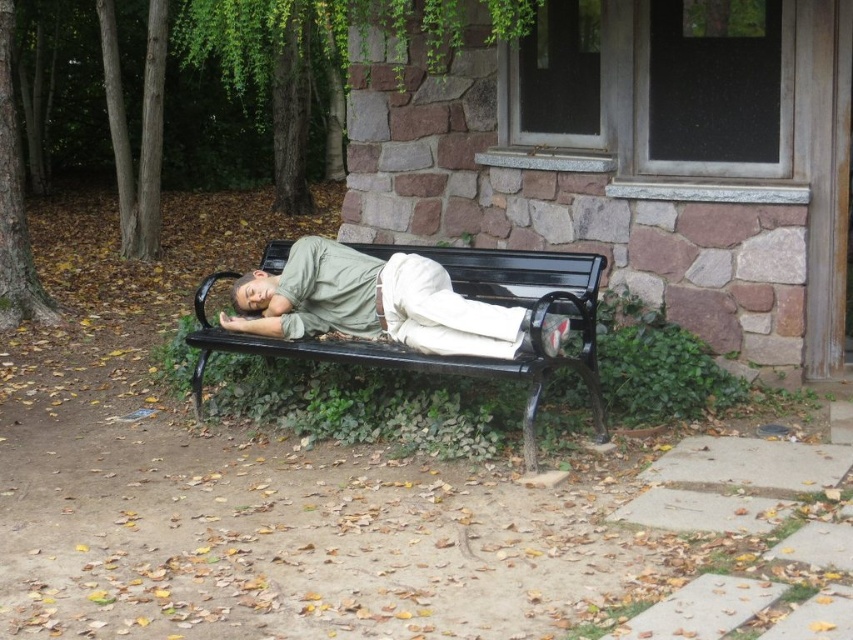
You are a photographer trying to capture the person on the black metal bench at center. To get a better shot, you want to position yourself so that the green matte shirt at center is visible without being blocked by the bench. Which side of the bench should you stand on?

You should stand on the right side of the black metal bench at center because the green matte shirt at center is positioned on the right side of the bench, allowing it to be visible without obstruction.

You are standing in a park and see a person lying on a bench. You want to take a photo of the green matte shirt at center and the black metal bench at center. Which object will appear larger in your photo?

The green matte shirt at center will appear larger in the photo because it is closer to the viewer than the black metal bench at center.